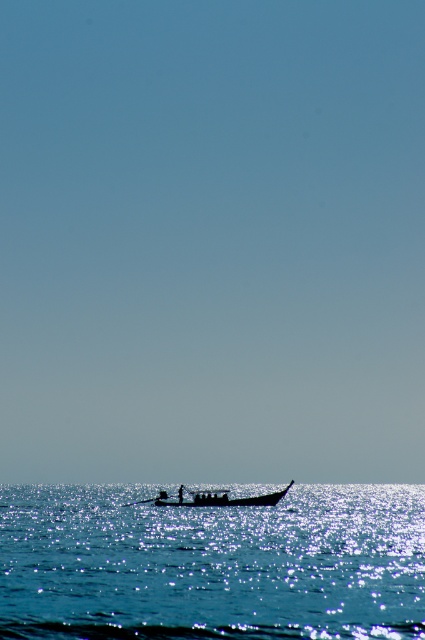
You are standing on the deck of a cruise ship and see the silhouette wooden boat at center and the black wood paddle at center in the distance. Which object would appear larger to you?

The silhouette wooden boat at center would appear larger because it is closer to the viewer than the black wood paddle at center.

You are a photographer trying to capture the silhouette wooden boat at center in your shot. The glistening blue water at lower center is reflecting sunlight. How might the reflection affect the visibility of the boat?

The glistening blue water at lower center is much taller than the silhouette wooden boat at center, so the reflection on the water may obscure or reduce the contrast of the boat, making it harder to see clearly against the bright, reflective surface.

Looking at this image, you are a photographer positioned at the point marked as point (212, 564) in the image. Based on the scene described, what do you see directly in front of you?

You see glistening blue water at lower center directly in front of you, as the point (212, 564) corresponds to that location.